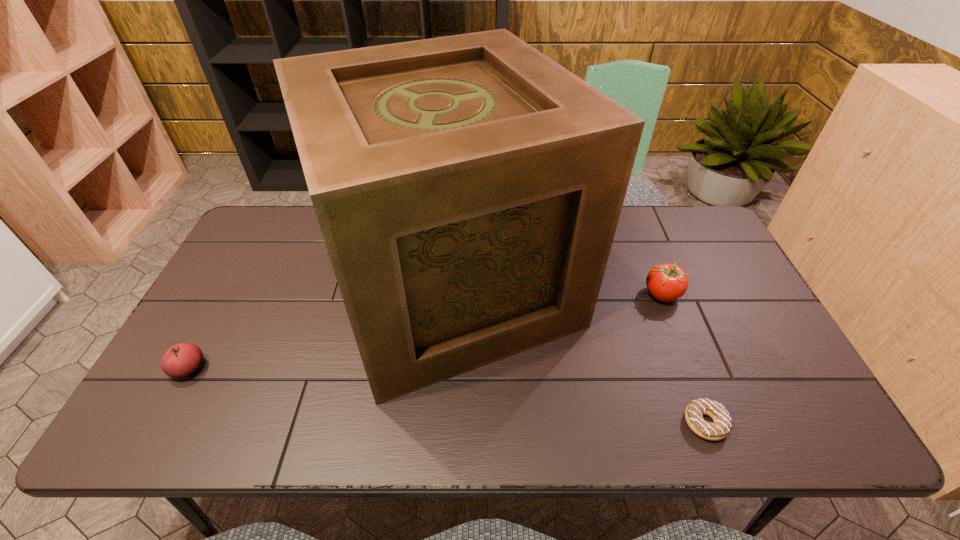
Find the location of `empty space between the second object from left to right and the left tomato`. empty space between the second object from left to right and the left tomato is located at coordinates (320, 327).

The image size is (960, 540). Find the location of `vacant point located between the shortest object and the right tomato`. vacant point located between the shortest object and the right tomato is located at coordinates (684, 359).

I want to click on empty space that is in between the shorter tomato and the third object from right to left, so click(x=320, y=327).

Locate an element on the screen. Image resolution: width=960 pixels, height=540 pixels. vacant area between the nearer tomato and the doughnut is located at coordinates (446, 396).

I want to click on unoccupied area between the doughnut and the tallest object, so click(x=578, y=355).

Identify the location of vacant space that is in between the doughnut and the nearer tomato. (446, 396).

Where is `the second closest object to the doughnut`? Image resolution: width=960 pixels, height=540 pixels. the second closest object to the doughnut is located at coordinates (666, 282).

Identify which object is the third closest to the second tallest object. Please provide its 2D coordinates. Your answer should be formatted as a tuple, i.e. [(x, y)], where the tuple contains the x and y coordinates of a point satisfying the conditions above.

[(180, 360)]

Find the location of `free space in the image that satisfies the following two spatial constraints: 1. on the front side of the tallest object; 2. on the right side of the farther tomato`. free space in the image that satisfies the following two spatial constraints: 1. on the front side of the tallest object; 2. on the right side of the farther tomato is located at coordinates (449, 294).

The width and height of the screenshot is (960, 540). I want to click on free point that satisfies the following two spatial constraints: 1. on the back side of the tallest object; 2. on the right side of the nearer tomato, so click(x=233, y=286).